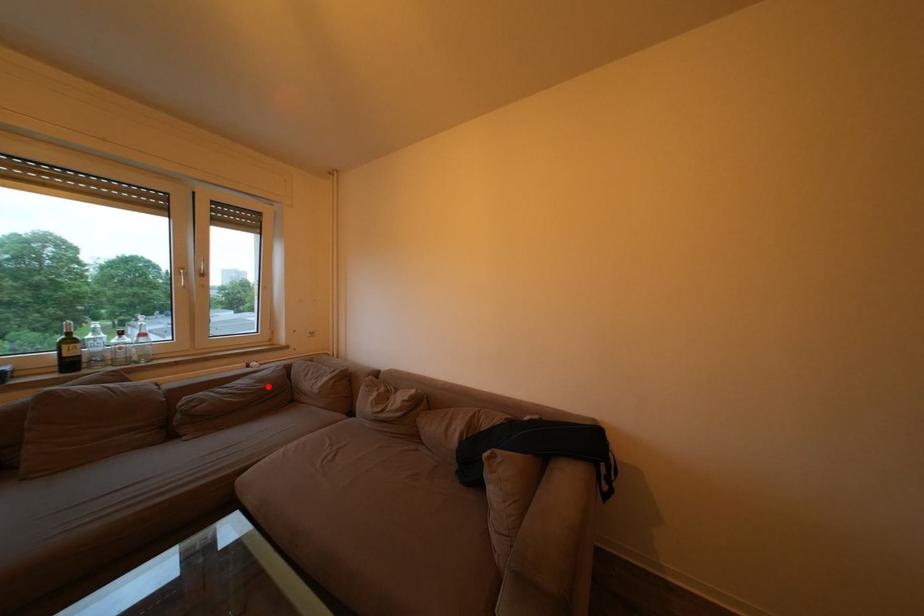
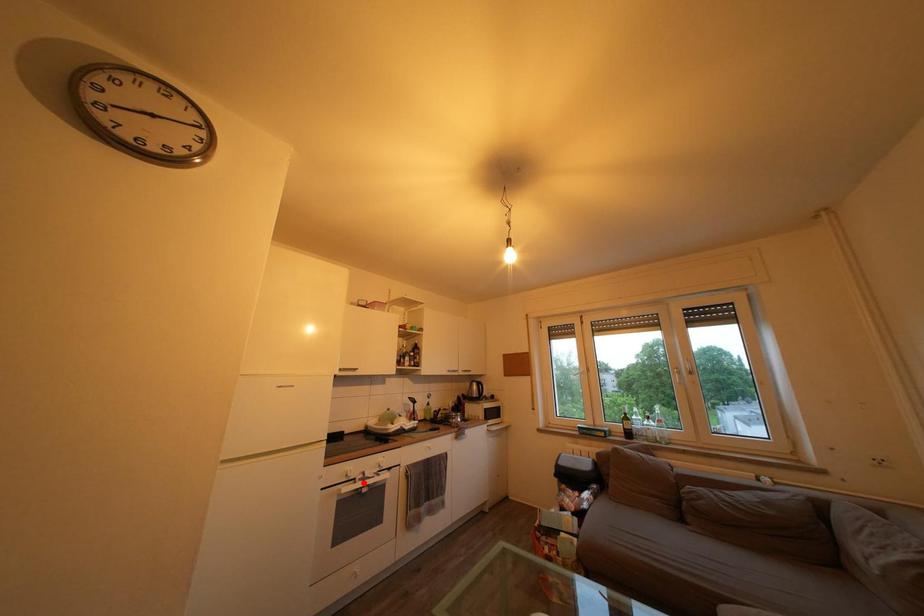
I am providing you with two images of the same scene from different viewpoints. A red point is marked on the first image and another point is marked on the second image. Are the points marked in image1 and image2 representing the same 3D position?

No